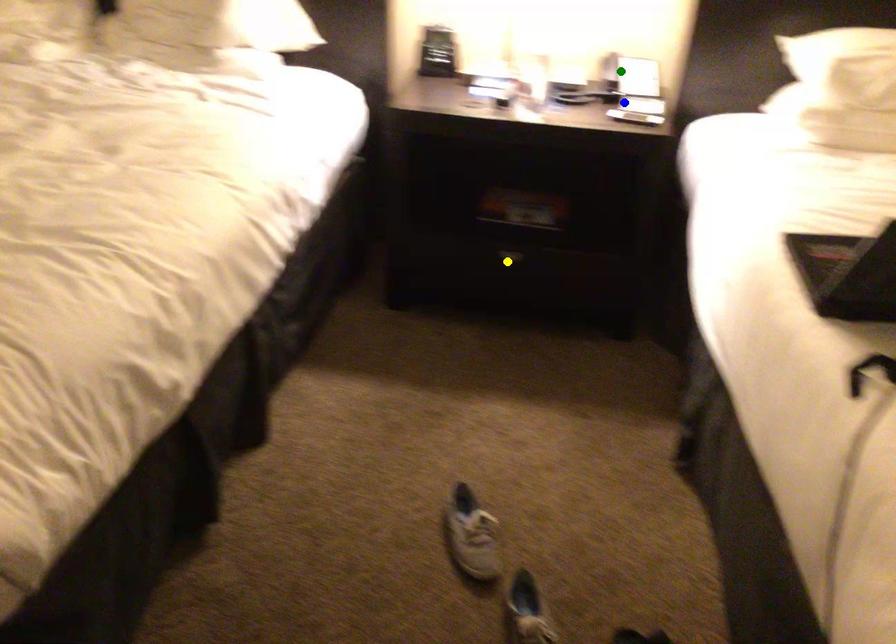
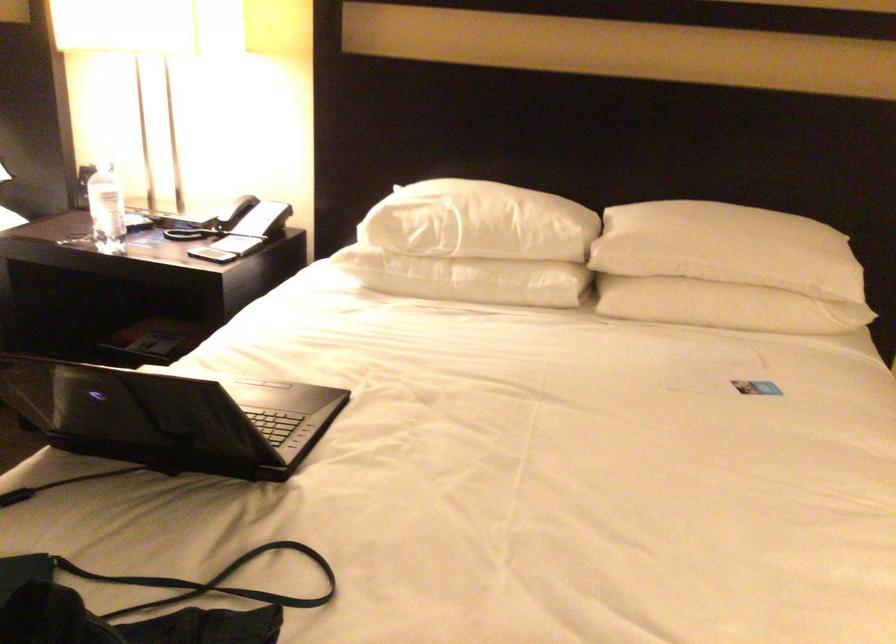
I am providing you with two images of the same scene from different viewpoints. Three points are marked in image1. Which point corresponds to a part or object that is occluded in image2?In image1, three points are marked. Which of them correspond to a part or object that is occluded in image2?Among the three points shown in image1, which one corresponds to a part or object that is no longer visible due to occlusion in image2?

Invisible in image2: yellow point.